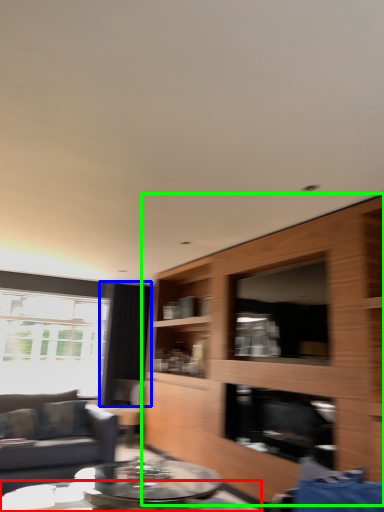
Question: Estimate the real-world distances between objects in this image. Which object is farther from coffee table (highlighted by a red box), curtain (highlighted by a blue box) or cabinetry (highlighted by a green box)?

Choices:
 (A) curtain
 (B) cabinetry

Answer: (A)